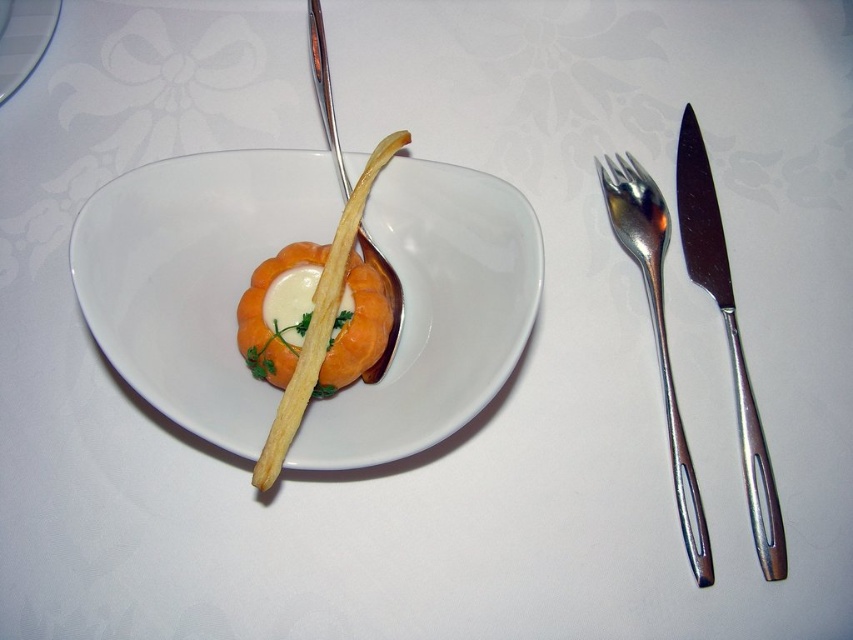
Between polished metal knife at right and silver metallic fork at right, which one appears on the right side from the viewer's perspective?

From the viewer's perspective, polished metal knife at right appears more on the right side.

Find the location of a particular element. polished metal knife at right is located at coordinates point(727,336).

What are the coordinates of `polished metal knife at right` in the screenshot? It's located at (727, 336).

Is white glossy bowl at center in front of orange matte salmon at center?

Yes.

Which is more to the left, white glossy bowl at center or orange matte salmon at center?

Positioned to the left is orange matte salmon at center.

Does point (244, 266) lie in front of point (363, 371)?

No, it is not.

Locate an element on the screen. This screenshot has height=640, width=853. white glossy bowl at center is located at coordinates (194, 276).

Between orange matte salmon at center and silver metallic fork at right, which one has less height?

orange matte salmon at center

Can you confirm if orange matte salmon at center is positioned above silver metallic fork at right?

Yes, orange matte salmon at center is above silver metallic fork at right.

What do you see at coordinates (277, 310) in the screenshot? The height and width of the screenshot is (640, 853). I see `orange matte salmon at center` at bounding box center [277, 310].

Identify the location of orange matte salmon at center. Image resolution: width=853 pixels, height=640 pixels. (277, 310).